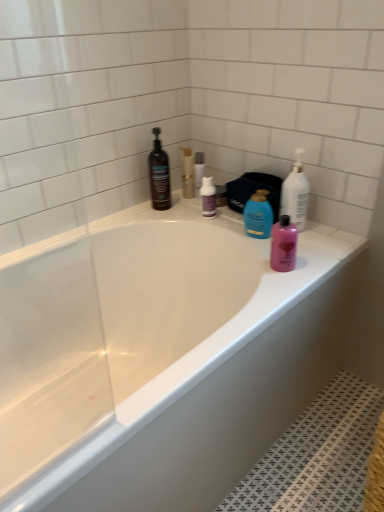
Find the location of a particular element. free space to the left of clear plastic bottle at upper center, which is counted as the second toiletry, starting from the front is located at coordinates (165, 203).